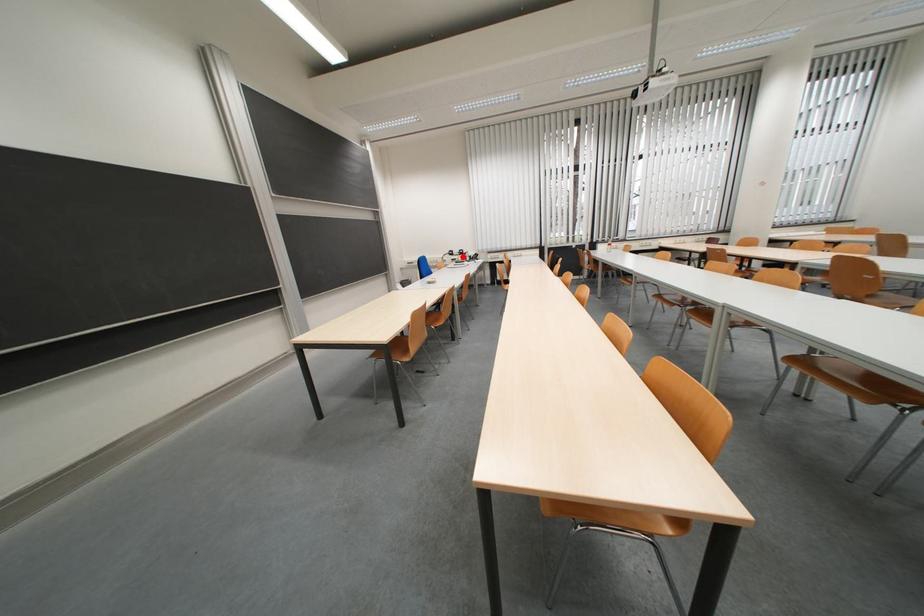
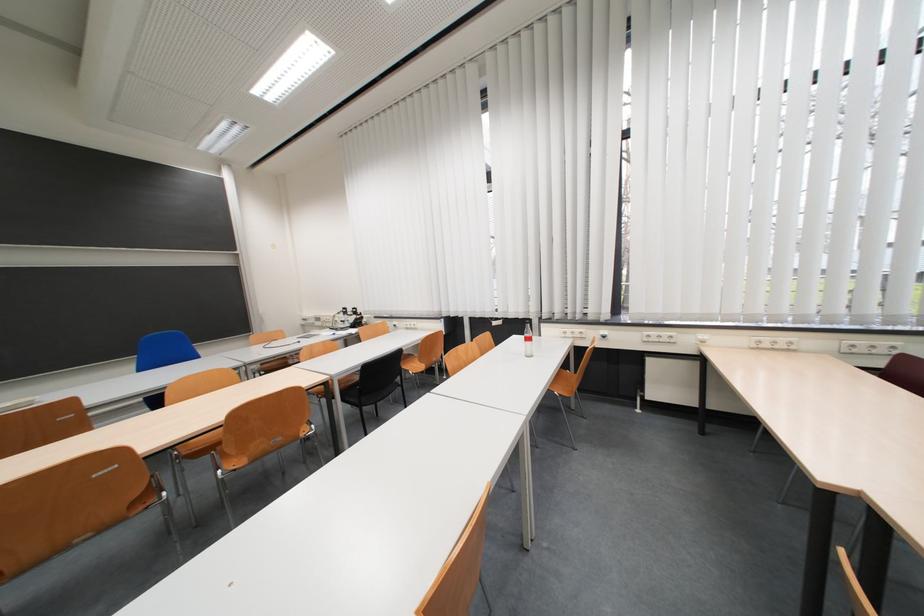
Question: I am providing you with two images of the same scene from different viewpoints. Image1 has a red point marked. In image2, the corresponding 3D location appears at what relative position? Reply with the corresponding letter.

Choices:
 (A) Closer
 (B) Farther

Answer: (B)